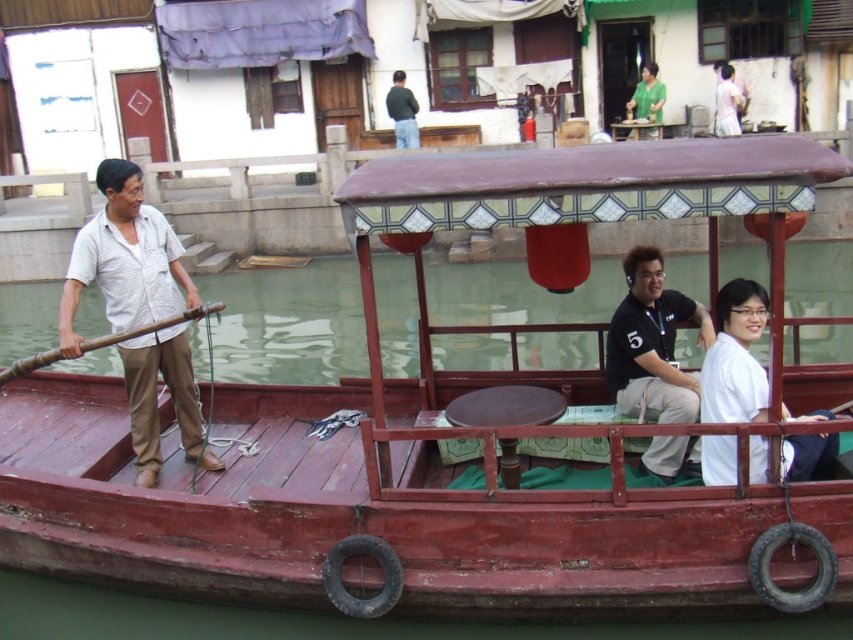
You are a tourist standing on the dock and want to take a photo of both the black matte shirt at center and the white matte shirt at upper right in the same frame. The camera you have can capture a maximum distance of 40 feet between objects. Will you be able to include both shirts in the photo?

The black matte shirt at center is 40.52 feet from the white matte shirt at upper right. Since the camera can only capture up to 40 feet between objects, the distance is too great. You won not be able to include both shirts in the same frame.

You are a photographer planning to take a picture of the wooden boat at center and the white matte shirt at upper right. Since you want both subjects to appear clearly in the frame, which one should you focus on first to ensure proper focus?

The wooden boat at center should be focused on first because it is larger than the white matte shirt at upper right, ensuring it will be in clear focus before adjusting for the smaller subject.

You are standing on the dock and see the wooden boat at center and the white matte shirt at upper right. Which object is closer to the left side of your view?

The wooden boat at center is closer to the left side of your view since it is positioned to the left of the white matte shirt at upper right.